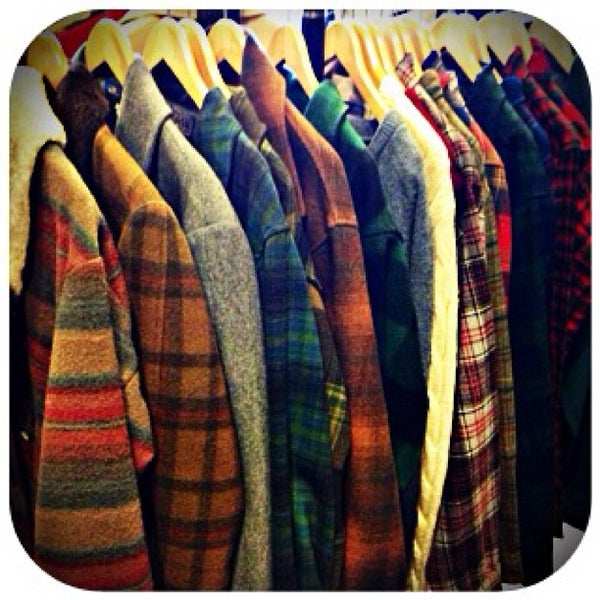
Identify the location of cloth hanger. (499, 44).